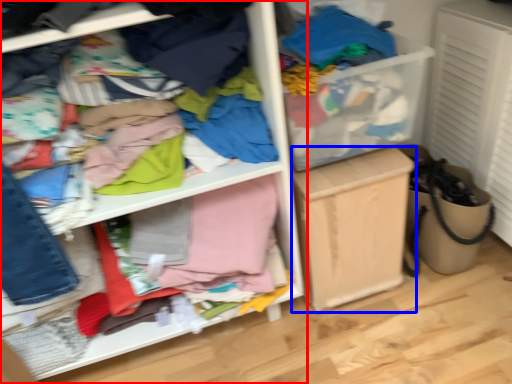
Question: Among these objects, which one is nearest to the camera, shelf (highlighted by a red box) or cabinetry (highlighted by a blue box)?

Choices:
 (A) shelf
 (B) cabinetry

Answer: (A)